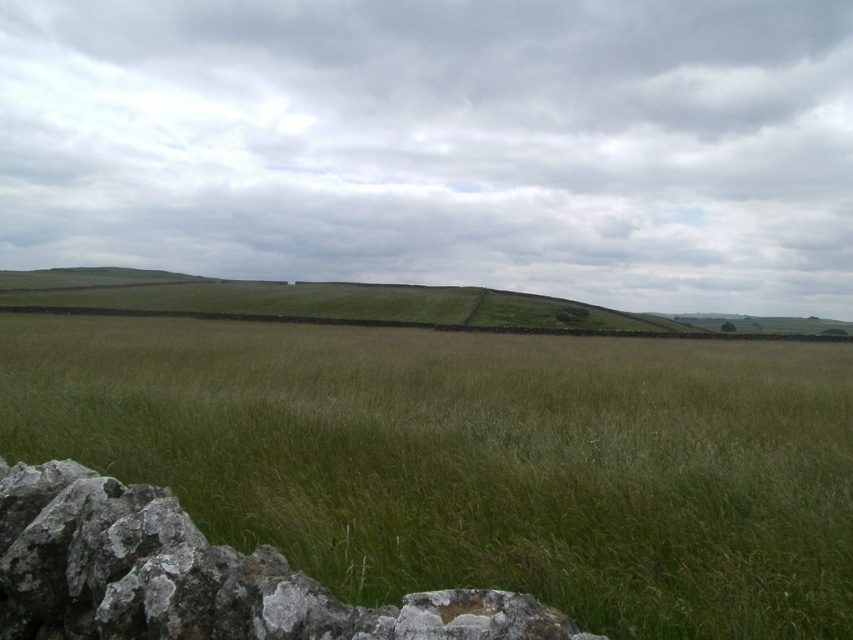
Does green grassy field at center appear under green grassy hillside at center?

Yes, green grassy field at center is below green grassy hillside at center.

Does green grassy field at center have a larger size compared to green grassy hillside at center?

Actually, green grassy field at center might be smaller than green grassy hillside at center.

Between point (664, 627) and point (409, 307), which one is positioned in front?

Point (664, 627)

Locate an element on the screen. Image resolution: width=853 pixels, height=640 pixels. green grassy field at center is located at coordinates (474, 460).

Can you confirm if gray rough stone at lower left is positioned above green grassy hillside at center?

No, gray rough stone at lower left is not above green grassy hillside at center.

Which is in front, point (12, 513) or point (196, 308)?

Positioned in front is point (12, 513).

I want to click on gray rough stone at lower left, so click(196, 577).

Which of these two, green grassy field at center or gray rough stone at lower left, stands shorter?

With less height is gray rough stone at lower left.

Can you confirm if green grassy field at center is shorter than gray rough stone at lower left?

Incorrect, green grassy field at center's height does not fall short of gray rough stone at lower left's.

At what (x,y) coordinates should I click in order to perform the action: click on green grassy field at center. Please return your answer as a coordinate pair (x, y). Looking at the image, I should click on coord(474,460).